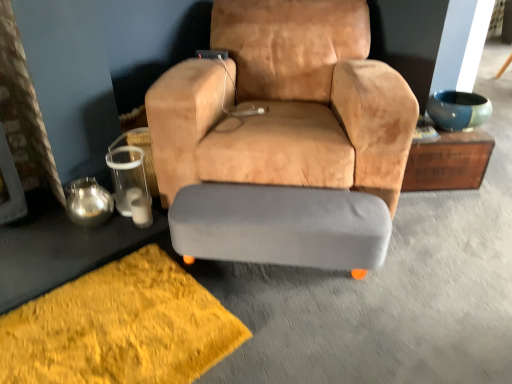
Question: Is shaggy yellow rug at lower left spatially inside gray fabric ottoman at center, or outside of it?

Choices:
 (A) inside
 (B) outside

Answer: (B)

Question: Based on their positions, is shaggy yellow rug at lower left located to the left or right of gray fabric ottoman at center?

Choices:
 (A) left
 (B) right

Answer: (A)

Question: Which object is the farthest from the metallic silver tray at lower left, marked as the first table in a bottom-to-top arrangement?

Choices:
 (A) shaggy yellow rug at lower left
 (B) suede tan armchair at center
 (C) wooden chest at upper right, which ranks as the first table in right-to-left order
 (D) gray fabric ottoman at center

Answer: (C)

Question: Which of these objects is positioned farthest from the suede tan armchair at center?

Choices:
 (A) gray fabric ottoman at center
 (B) shaggy yellow rug at lower left
 (C) metallic silver tray at lower left, marked as the first table in a bottom-to-top arrangement
 (D) wooden chest at upper right, which is the second table in left-to-right order

Answer: (D)